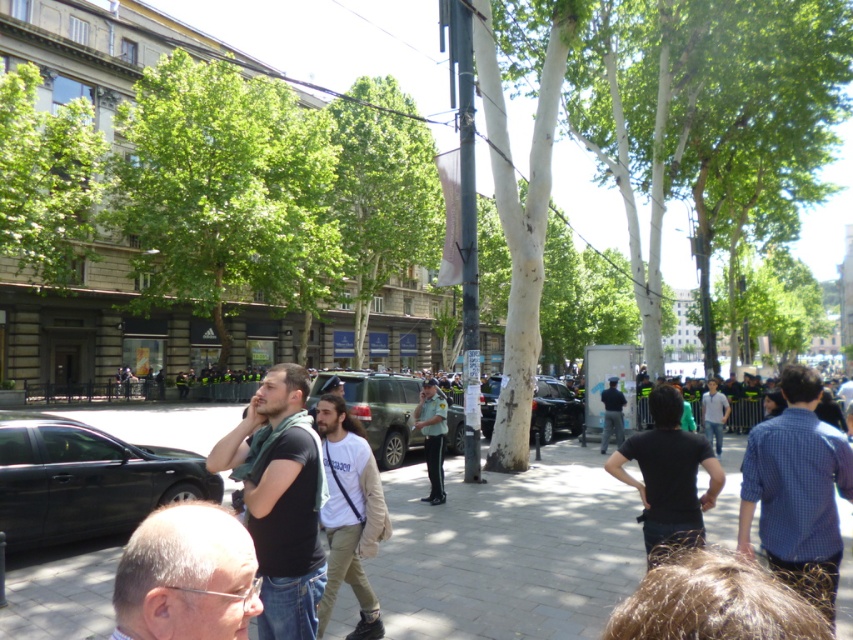
Question: Does matte black suv at center appear on the right side of uniformed officer at center?

Choices:
 (A) yes
 (B) no

Answer: (B)

Question: Does matte black suv at center have a smaller size compared to uniformed officer at center?

Choices:
 (A) no
 (B) yes

Answer: (A)

Question: Which point appears closest to the camera in this image?

Choices:
 (A) (712, 385)
 (B) (239, 554)
 (C) (297, 481)
 (D) (163, 467)

Answer: (B)

Question: Based on their relative distances, which object is farther from the light brown cotton shirt at center?

Choices:
 (A) gray hair at lower center
 (B) blue checkered shirt at center
 (C) black matte shirt at center
 (D) matte black suv at center

Answer: (D)

Question: Does black matte car at lower left appear on the right side of denim jeans at center?

Choices:
 (A) no
 (B) yes

Answer: (A)

Question: Which point is closer to the camera taking this photo?

Choices:
 (A) (250, 532)
 (B) (238, 616)
 (C) (352, 584)
 (D) (566, 417)

Answer: (B)